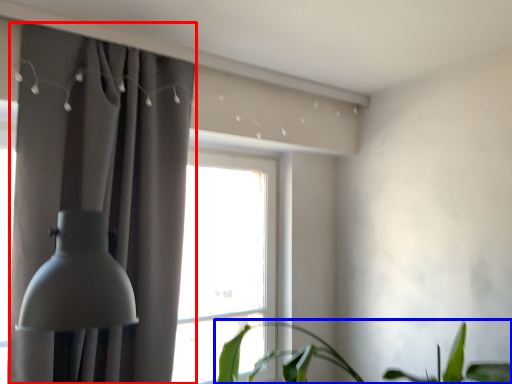
Question: Which point is further to the camera, curtain (highlighted by a red box) or houseplant (highlighted by a blue box)?

Choices:
 (A) curtain
 (B) houseplant

Answer: (A)